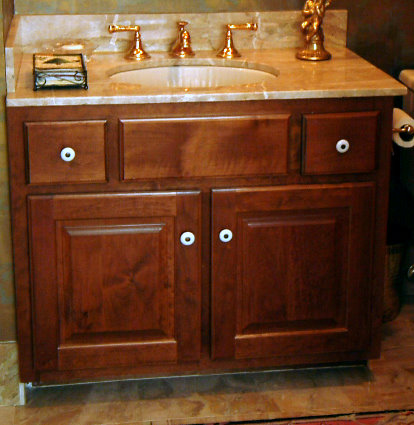
The width and height of the screenshot is (414, 425). I want to click on faucet, so click(x=186, y=40).